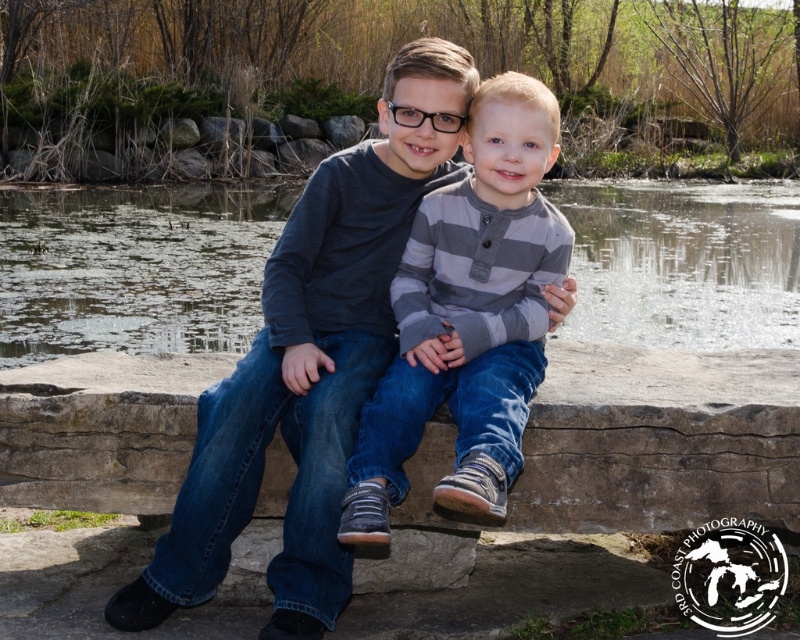
Is matte blue jeans at center closer to the viewer compared to gray striped shirt at center?

No, matte blue jeans at center is behind gray striped shirt at center.

Between matte blue jeans at center and gray striped shirt at center, which one has more height?

With more height is matte blue jeans at center.

The width and height of the screenshot is (800, 640). I want to click on matte blue jeans at center, so click(x=310, y=362).

Does clear water at center have a lesser height compared to matte blue jeans at center?

Incorrect, clear water at center's height does not fall short of matte blue jeans at center's.

Can you confirm if clear water at center is taller than matte blue jeans at center?

Indeed, clear water at center has a greater height compared to matte blue jeans at center.

Does point (118, 273) lie in front of point (248, 474)?

No.

Find the location of a particular element. The image size is (800, 640). clear water at center is located at coordinates (134, 268).

Is clear water at center in front of gray striped shirt at center?

No, it is behind gray striped shirt at center.

Who is more distant from viewer, (192, 320) or (468, 296)?

Positioned behind is point (192, 320).

Is point (636, 289) positioned behind point (372, 538)?

Yes.

What are the coordinates of `clear water at center` in the screenshot? It's located at (134, 268).